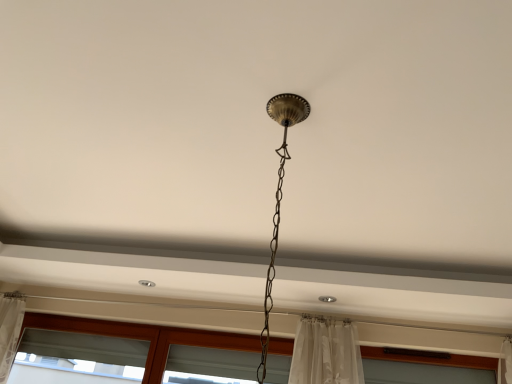
This screenshot has height=384, width=512. Find the location of `translucent white curtain at bottom`. translucent white curtain at bottom is located at coordinates (145, 337).

The height and width of the screenshot is (384, 512). What do you see at coordinates (145, 337) in the screenshot?
I see `translucent white curtain at bottom` at bounding box center [145, 337].

The width and height of the screenshot is (512, 384). I want to click on translucent white curtain at bottom, so (145, 337).